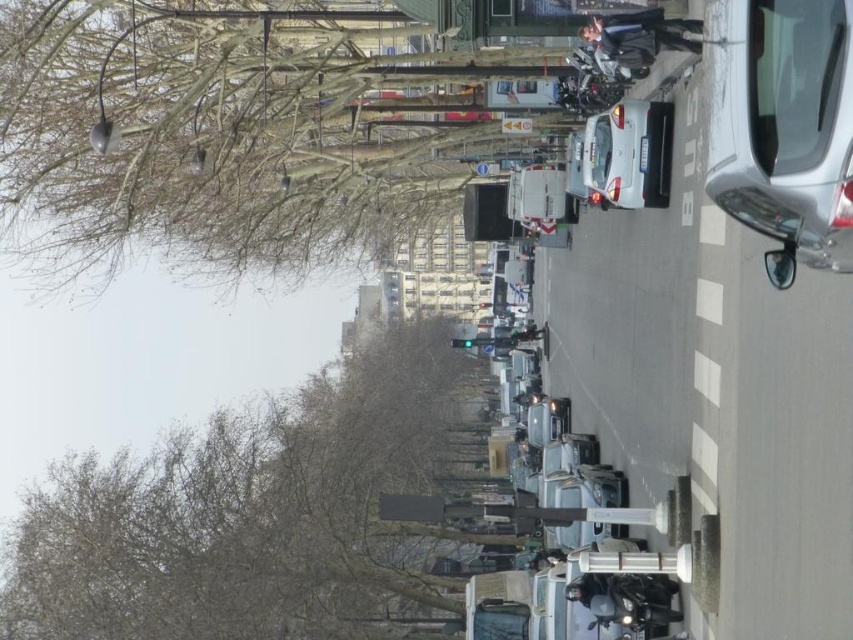
Question: Considering the relative positions of brown leafless tree at upper left and bare branches at left in the image provided, where is brown leafless tree at upper left located with respect to bare branches at left?

Choices:
 (A) left
 (B) right

Answer: (B)

Question: Among these points, which one is farthest from the camera?

Choices:
 (A) (666, 112)
 (B) (851, 257)
 (C) (35, 48)

Answer: (C)

Question: Does brown leafless tree at upper left appear over silver metallic car at right?

Choices:
 (A) yes
 (B) no

Answer: (A)

Question: Estimate the real-world distances between objects in this image. Which object is farther from the brown leafless tree at upper left?

Choices:
 (A) bare branches at left
 (B) silver metallic car at right

Answer: (B)

Question: Is silver metallic car at right above white glossy car at center?

Choices:
 (A) no
 (B) yes

Answer: (A)

Question: Which point appears farthest from the camera in this image?

Choices:
 (A) (668, 108)
 (B) (779, 113)
 (C) (213, 452)

Answer: (C)